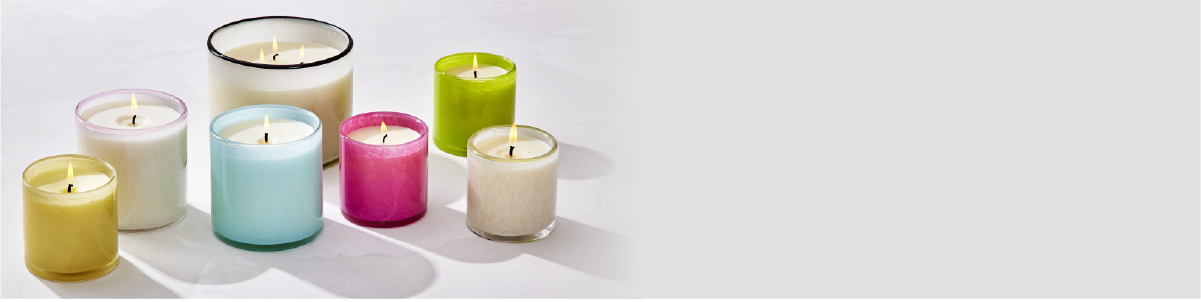
I want to click on candles, so click(77, 219), click(144, 149), click(234, 66), click(263, 203), click(381, 185), click(507, 173), click(452, 89).